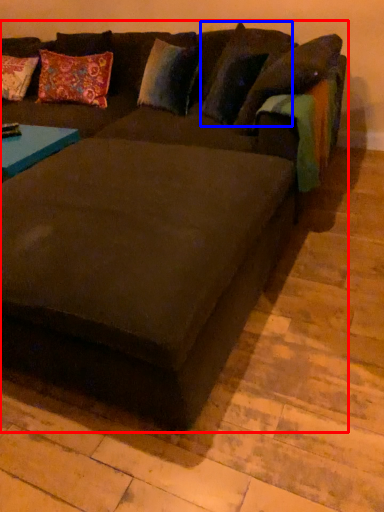
Question: Which object is further to the camera taking this photo, studio couch (highlighted by a red box) or pillow (highlighted by a blue box)?

Choices:
 (A) studio couch
 (B) pillow

Answer: (B)